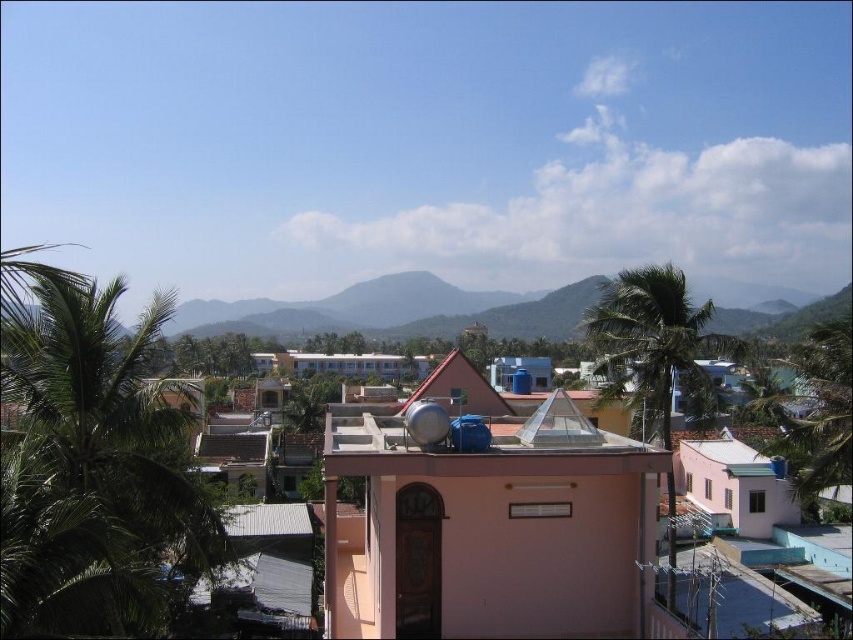
Question: Can you confirm if green leafy palm tree at left is smaller than green leafy palm tree at center?

Choices:
 (A) no
 (B) yes

Answer: (B)

Question: Which of the following is the farthest from the observer?

Choices:
 (A) green leafy palm tree at center
 (B) green leafy palm tree at left

Answer: (A)

Question: Is green leafy palm tree at left wider than green leafy palm tree at center?

Choices:
 (A) yes
 (B) no

Answer: (B)

Question: Where is green leafy palm tree at left located in relation to green leafy palm tree at center in the image?

Choices:
 (A) above
 (B) below

Answer: (A)